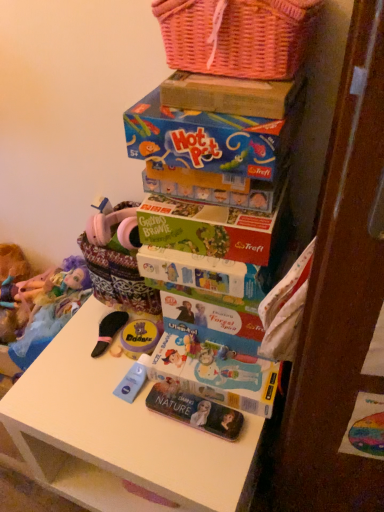
Identify the location of free space in front of metallic silver magazine at lower center. pos(193,464).